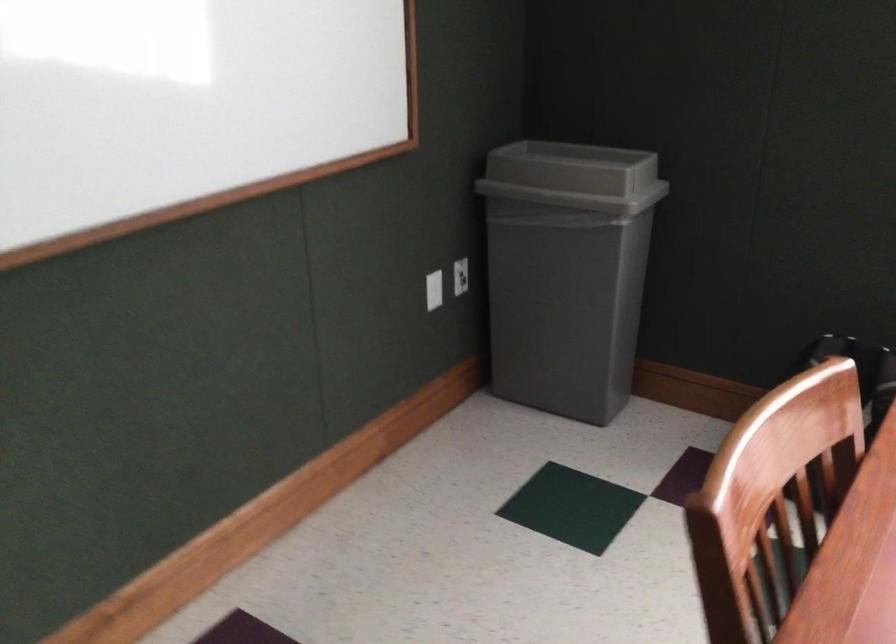
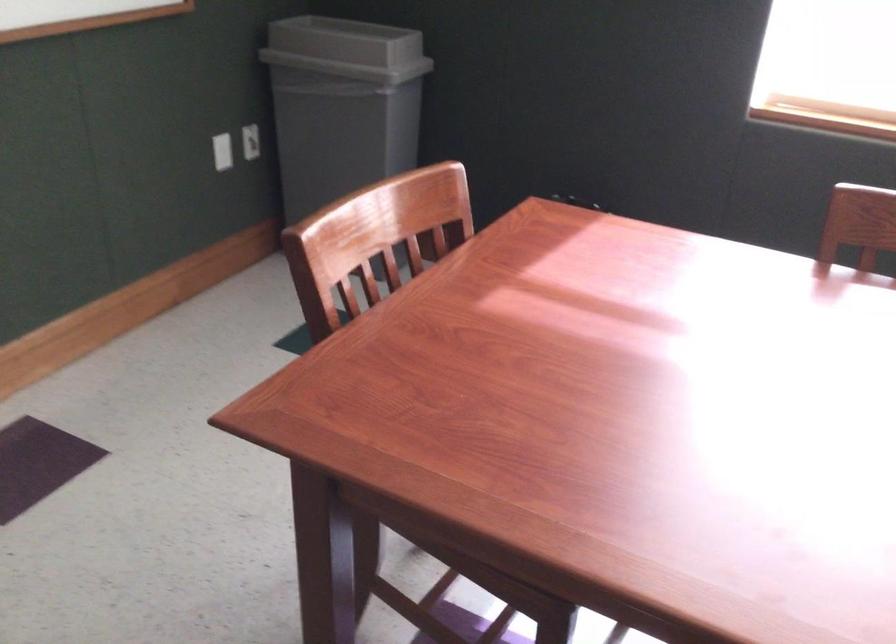
Question: The camera is either moving clockwise (left) or counter-clockwise (right) around the object. The first image is from the beginning of the video and the second image is from the end. Is the camera moving left or right when shooting the video?

Choices:
 (A) Left
 (B) Right

Answer: (A)